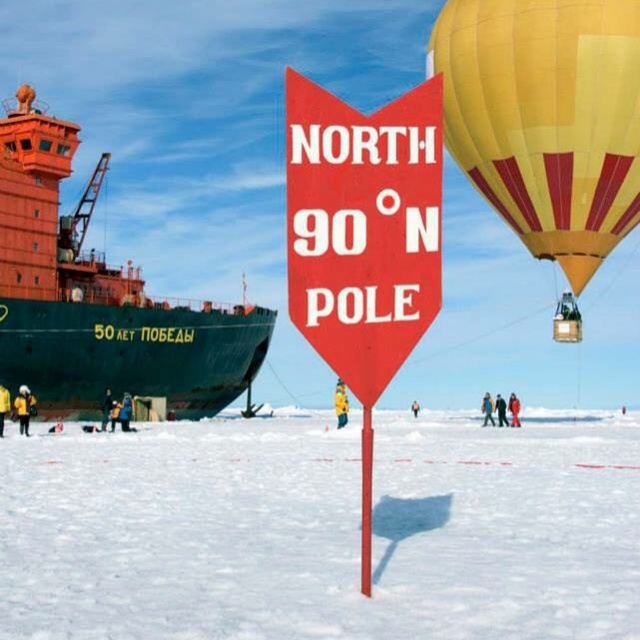
You are an explorer standing at the North Pole. You see the white powdery snow at center and the green matte ship at left. Which object is taller?

The green matte ship at left is taller than the white powdery snow at center.

You are standing at the North Pole and see the white powdery snow at center and the red plastic sign at center. Which object is located higher in the image?

The red plastic sign at center is higher than the white powdery snow at center because the white powdery snow at center is below it.

From the picture: You are an explorer standing at the North Pole. You see the white powdery snow at center and the red plastic sign at center. Which object is wider?

The white powdery snow at center might be wider than the red plastic sign at center.